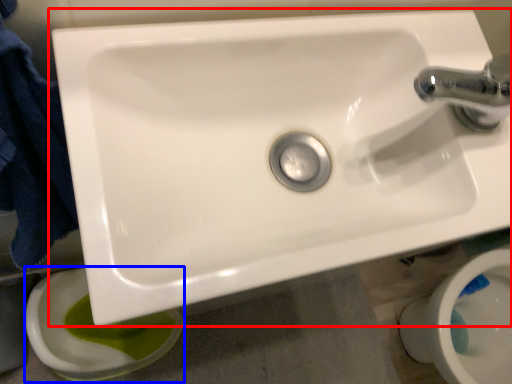
Question: Which object is closer to the camera taking this photo, sink (highlighted by a red box) or toilet bowl (highlighted by a blue box)?

Choices:
 (A) sink
 (B) toilet bowl

Answer: (A)